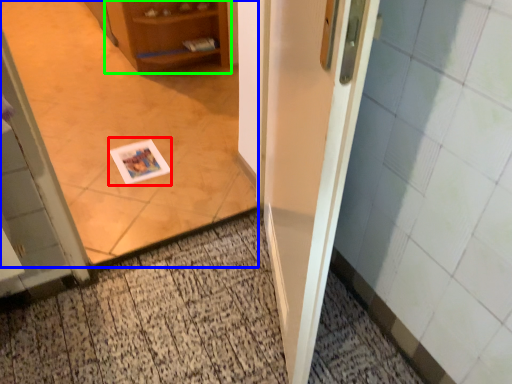
Question: Which object is positioned closest to postcard (highlighted by a red box)? Select from corridor (highlighted by a blue box) and cabinetry (highlighted by a green box).

Choices:
 (A) corridor
 (B) cabinetry

Answer: (A)